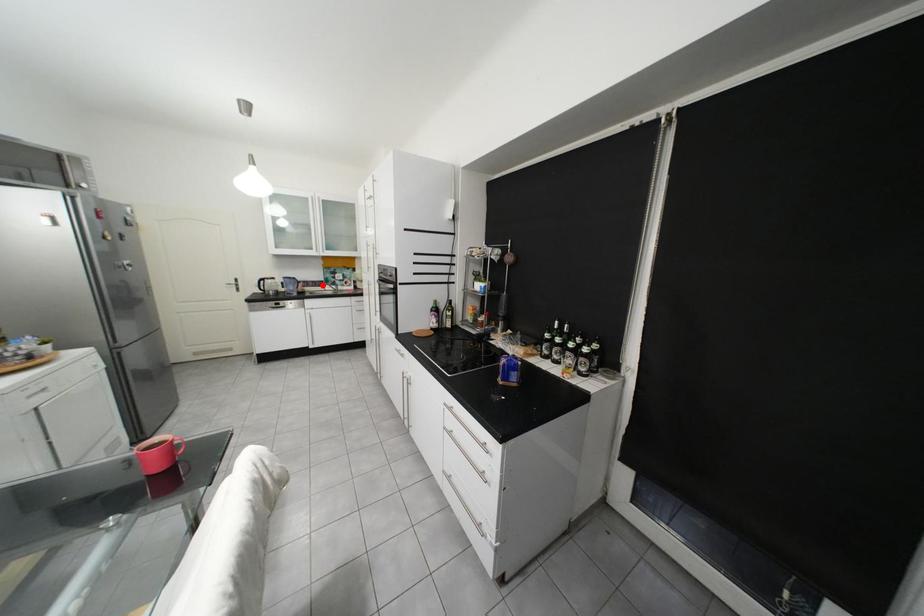
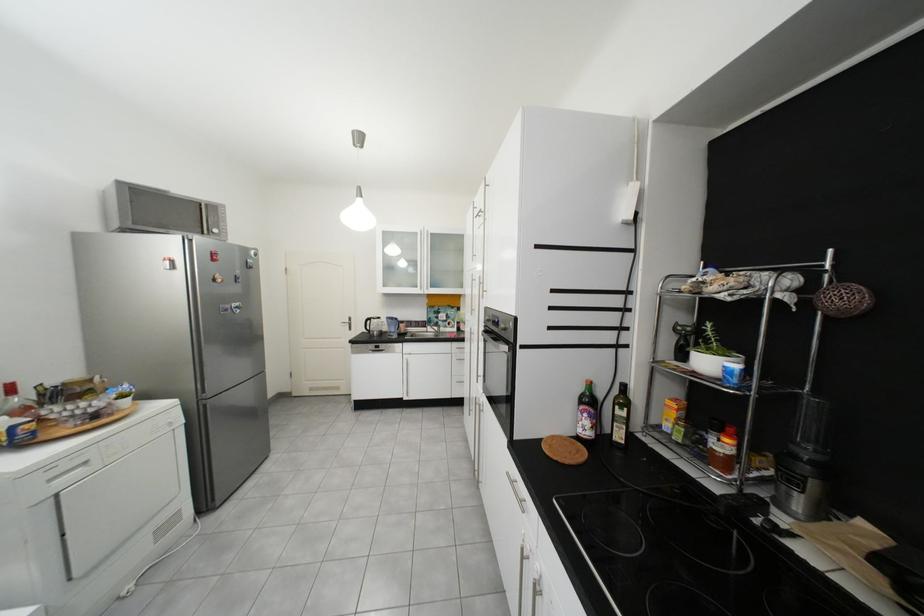
Question: I am providing you with two images of the same scene from different viewpoints. Given a red point in image1, look at the same physical point in image2. Is it:

Choices:
 (A) Closer to the viewpoint
 (B) Farther from the viewpoint

Answer: (B)